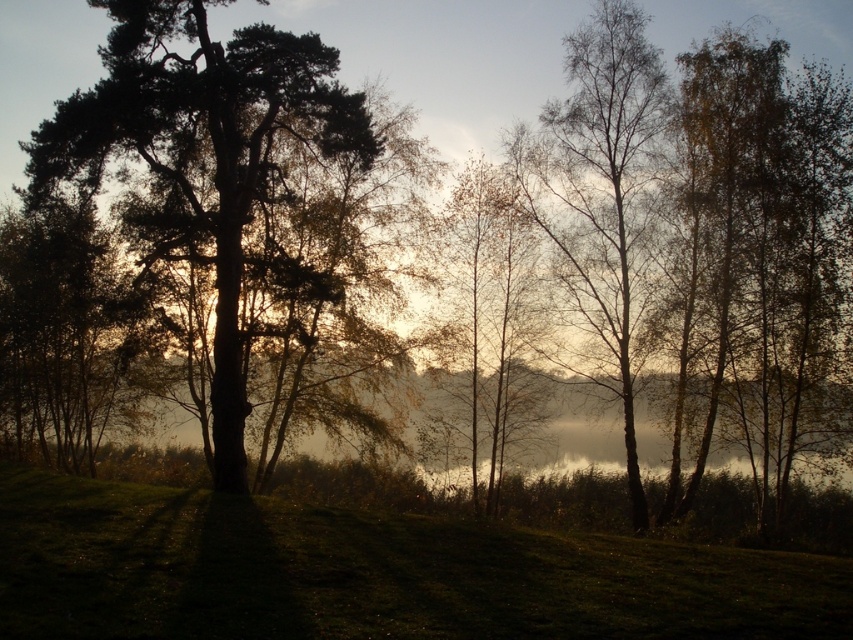
You are standing at the point marked as point (372, 573) in the forest scene. Based on the description, what type of terrain are you currently standing on?

The point (372, 573) is on the green grassy hillside at lower center, so you are standing on a grassy slope.

You are a hiker standing at the base of the green grassy hillside at lower center and want to reach the top of the bare birch tree at right. Which path would require less climbing effort?

The green grassy hillside at lower center has a lesser height compared to the bare birch tree at right, so climbing the green grassy hillside at lower center would require less effort than reaching the top of the bare birch tree at right.